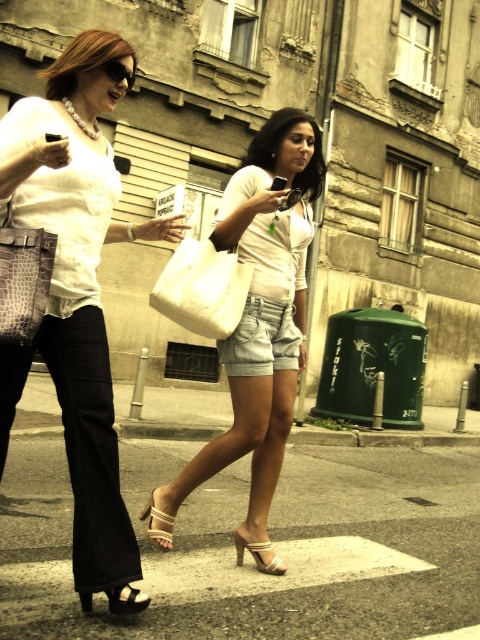
Question: Which object appears farthest from the camera in this image?

Choices:
 (A) white fabric bag at center
 (B) matte white shirt at center
 (C) leather high-heeled sandal at lower left

Answer: (B)

Question: Does matte white blouse at center have a larger size compared to denim shorts at center?

Choices:
 (A) no
 (B) yes

Answer: (B)

Question: Does white fabric bag at center appear on the right side of denim shorts at center?

Choices:
 (A) yes
 (B) no

Answer: (B)

Question: Does denim shorts at center come in front of beige leather sandal at center?

Choices:
 (A) no
 (B) yes

Answer: (A)

Question: Which object appears farthest from the camera in this image?

Choices:
 (A) matte white shirt at center
 (B) matte black sunglasses at upper left
 (C) denim shorts at center
 (D) beige leather sandal at center

Answer: (A)

Question: Which point is closer to the camera taking this photo?

Choices:
 (A) (79, 454)
 (B) (168, 516)
 (C) (277, 340)
 (D) (128, 586)

Answer: (A)